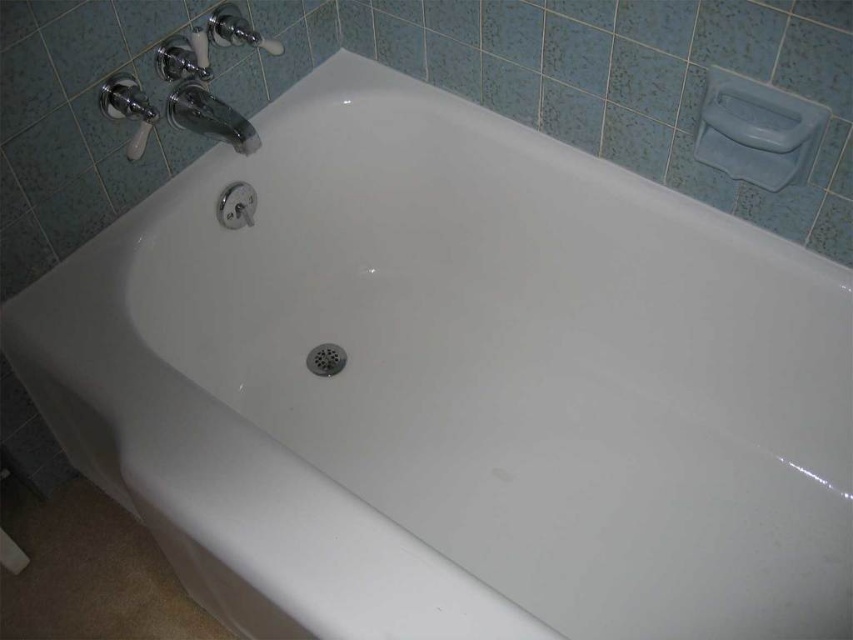
You are standing in front of the bathtub and want to reach both points. Which point, point (x=228, y=129) or point (x=323, y=344), will you reach first?

Point (x=228, y=129) is closer to the viewer than point (x=323, y=344), so you will reach point (x=228, y=129) first.

You are designing a bathroom layout and need to ensure that the chrome metallic faucet at upper left and the metallic silver drain at center are spaced appropriately. Based on their heights, which one should be placed higher to maintain proper water flow?

The chrome metallic faucet at upper left should be placed higher than the metallic silver drain at center because it has a greater height, ensuring proper water flow.